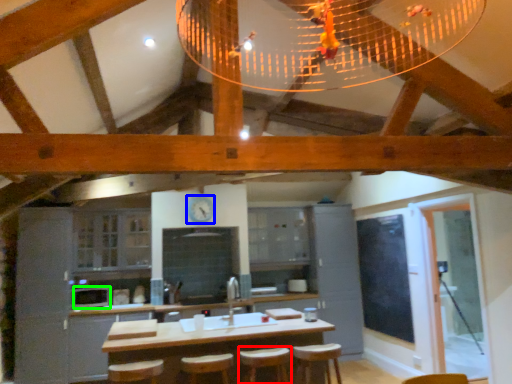
Question: Which is nearer to the bar stool (highlighted by a red box)? clock (highlighted by a blue box) or appliance (highlighted by a green box).

Choices:
 (A) clock
 (B) appliance

Answer: (A)